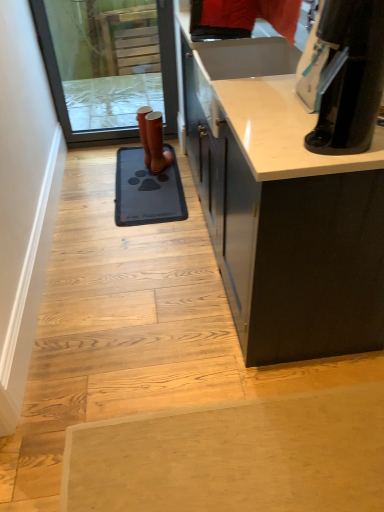
The height and width of the screenshot is (512, 384). I want to click on vacant area that is in front of white smooth door at left, so click(129, 362).